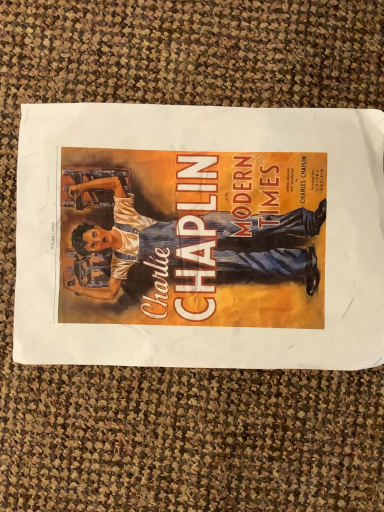
Where is `matte blue overalls at center`? The height and width of the screenshot is (512, 384). matte blue overalls at center is located at coordinates (200, 237).

Image resolution: width=384 pixels, height=512 pixels. Describe the element at coordinates (200, 237) in the screenshot. I see `matte blue overalls at center` at that location.

Find the location of a particular element. The image size is (384, 512). matte blue overalls at center is located at coordinates (200, 237).